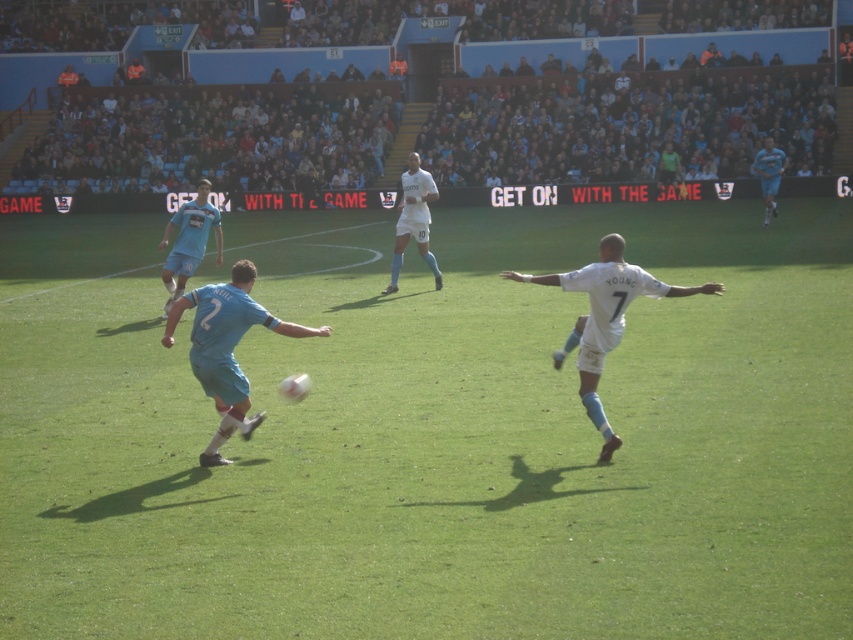
From the picture: You are a soccer coach analyzing the match. You notice two players at the center of the field. Which player is shorter between the light blue jersey at center and the white matte soccer player at center?

The light blue jersey at center is not as tall as the white matte soccer player at center, so the light blue jersey at center is shorter.

You are a soccer coach observing the match. You notice two players at the center of the field. Which player is positioned to the left of the other? The players are the light blue jersey at center and the white matte soccer player at center.

The light blue jersey at center is positioned to the left of the white matte soccer player at center.

Based on the scene description, where is the light blue jersey at center located in terms of its 2D coordinates?

The light blue jersey at center is located at the 2D coordinates of point (189,241).